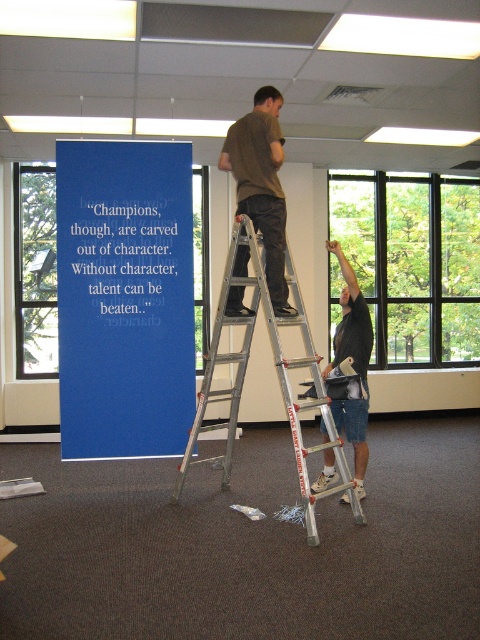
Where is the brown cotton shirt at upper center located in the image?

The brown cotton shirt at upper center is located at point (x=262, y=184).

You are trying to hang a new poster on the wall but need to know if the blue matte sign at center is taller than the brown cotton shirt at upper center. Based on the scene description, can you confirm this?

Yes, the blue matte sign at center is much taller than the brown cotton shirt at upper center according to the description.

You are standing in the room and want to reach both the point at coordinates (84,221) and the point at coordinates (264,164). Which point should you approach first if you want to reach the one closer to you first?

You should approach point (84,221) first because it is closer to you than point (264,164).